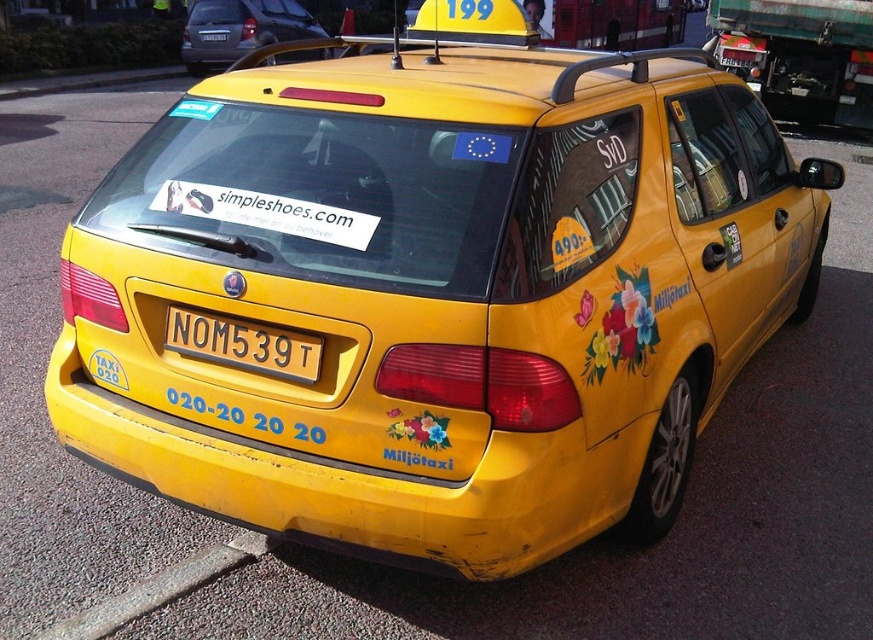
Who is more distant from viewer, (205, 3) or (191, 589)?

The point (205, 3) is more distant.

Can you confirm if yellow matte taxi at upper center is positioned above gray asphalt curb at lower left?

Yes.

Locate an element on the screen. yellow matte taxi at upper center is located at coordinates (239, 29).

Can you confirm if yellow matte taxi at upper center is wider than yellow plastic license plate at center?

Indeed, yellow matte taxi at upper center has a greater width compared to yellow plastic license plate at center.

Which is more to the right, yellow matte taxi at upper center or yellow plastic license plate at center?

Positioned to the right is yellow plastic license plate at center.

Does point (267, 19) come farther from viewer compared to point (175, 323)?

Yes, it is behind point (175, 323).

In order to click on yellow matte taxi at upper center in this screenshot , I will do `click(239, 29)`.

Does yellow plastic license plate at center have a greater width compared to gray asphalt curb at lower left?

Incorrect, yellow plastic license plate at center's width does not surpass gray asphalt curb at lower left's.

Identify the location of yellow plastic license plate at center. This screenshot has width=873, height=640. (243, 344).

This screenshot has height=640, width=873. Find the location of `yellow plastic license plate at center`. yellow plastic license plate at center is located at coordinates (243, 344).